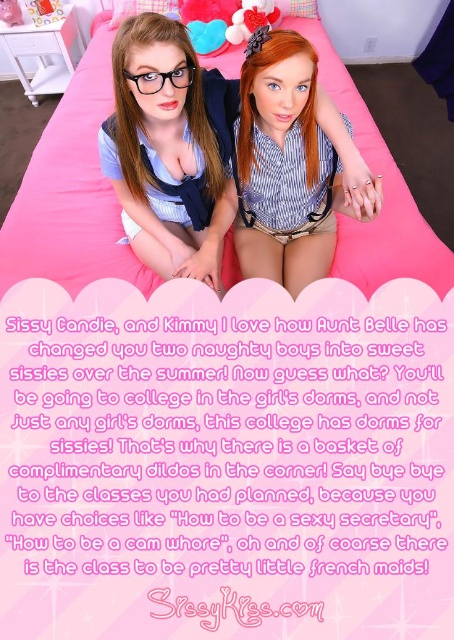
From the picture: You are a photographer trying to capture a closeup of the pink fabric bed at center and the matte blue shirt at center. Since the camera can only focus on one object at a time, which object should you focus on first if you want to ensure the wider object is in focus?

The pink fabric bed at center is wider than the matte blue shirt at center, so you should focus on the pink fabric bed at center first to ensure the wider object is in focus.

In the scene shown: You are an interior designer planning to place a new lamp on the bed. The lamp requires a space of 10 cm by 10 cm. Can you determine if there is enough space near the matte blue shirt at center to accommodate the lamp?

The matte blue shirt at center is located at point [166,140]. Since the exact dimensions of the bed and the surrounding objects are not provided, it is impossible to determine if there is sufficient space for the lamp near the matte blue shirt at center.

You are standing in the bedroom and want to place a small gift on the bed. The gift needs to be placed exactly at the point marked as point (166, 140). What object is located at that point?

The point (166, 140) is occupied by the matte blue shirt at center.